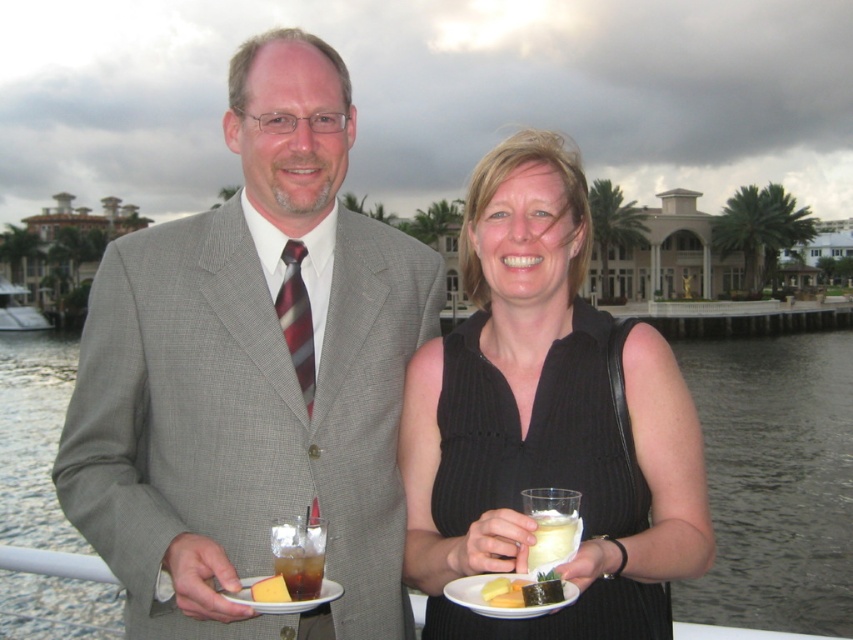
You are a photographer taking a closeup shot of the white matte plate at lower center and the yellow cheese at lower center. Which object should you zoom in on to ensure both fit in the frame without cropping?

The white matte plate at lower center is wider than the yellow cheese at lower center, so you should zoom in on the white matte plate at lower center to ensure both fit in the frame without cropping.